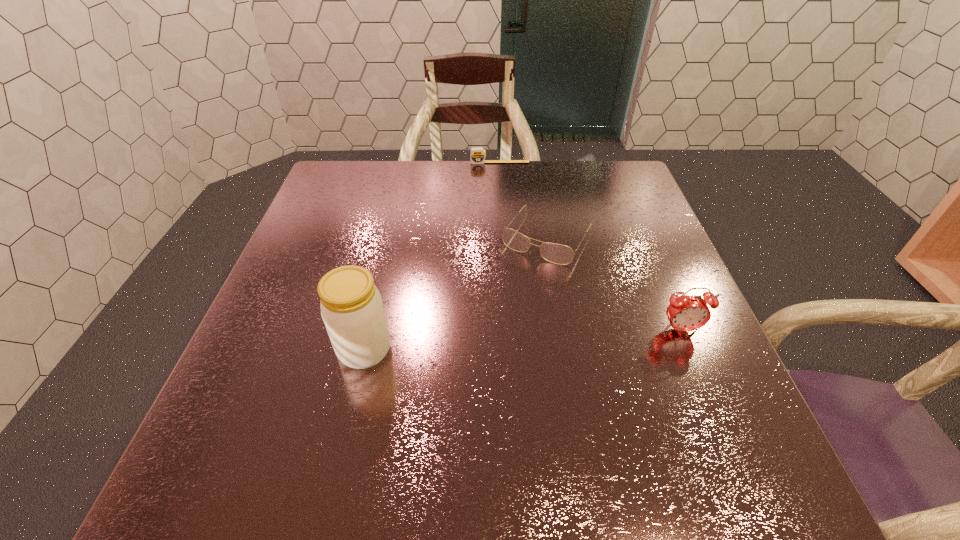
Where is `jar`? This screenshot has height=540, width=960. jar is located at coordinates (351, 306).

Find the location of a particular element. the leftmost object is located at coordinates (351, 306).

You are a GUI agent. You are given a task and a screenshot of the screen. Output one action in this format:
    pyautogui.click(x=<x>, y=<y>)
    Task: Click on the alarm clock
    This screenshot has height=540, width=960.
    Given the screenshot: What is the action you would take?
    pyautogui.click(x=685, y=313)

The image size is (960, 540). What are the coordinates of `the second tallest object` in the screenshot? It's located at (685, 313).

The height and width of the screenshot is (540, 960). Identify the location of the second farthest object. (559, 254).

Where is `the farthest object`? The height and width of the screenshot is (540, 960). the farthest object is located at coordinates (477, 156).

You are a GUI agent. You are given a task and a screenshot of the screen. Output one action in this format:
    pyautogui.click(x=<x>, y=<y>)
    Task: Click on the shortest object
    
    Given the screenshot: What is the action you would take?
    pyautogui.click(x=477, y=156)

The image size is (960, 540). I want to click on vacant area located 0.340m on the right of the leftmost object, so click(568, 349).

You are a GUI agent. You are given a task and a screenshot of the screen. Output one action in this format:
    pyautogui.click(x=<x>, y=<y>)
    Task: Click on the vacant position located on the face of the second tallest object
    
    Given the screenshot: What is the action you would take?
    pyautogui.click(x=700, y=375)

Locate an element on the screen. vacant space located 0.230m on the front-facing side of the spectacles is located at coordinates (486, 332).